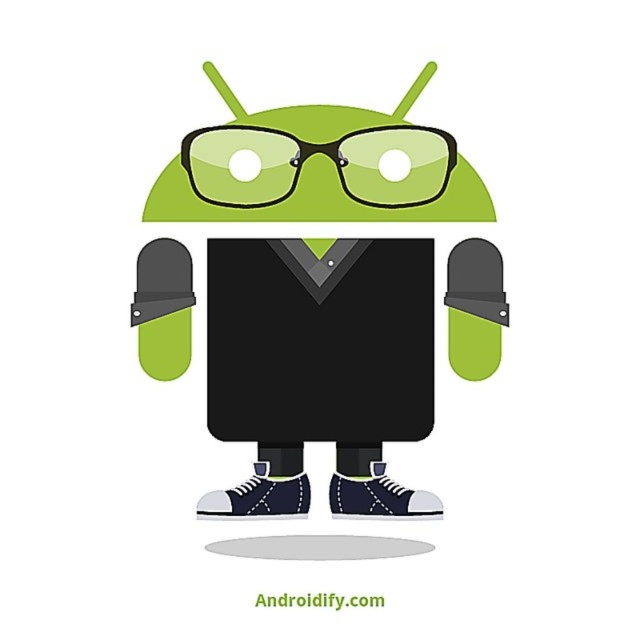
You are an artist sketching the scene. You need to draw the matte black android at center and the green matte android head at upper center. Which object should you draw first to maintain proper spatial hierarchy?

You should draw the green matte android head at upper center first because it is positioned above the matte black android at center, so drawing it first allows you to layer the matte black android at center underneath properly.